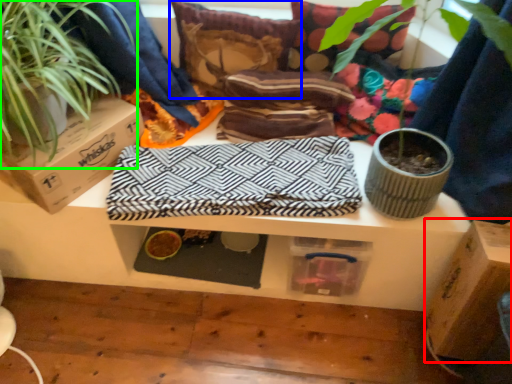
Question: Which object is positioned closest to cardboard box (highlighted by a red box)? Select from pillow (highlighted by a blue box) and houseplant (highlighted by a green box).

Choices:
 (A) pillow
 (B) houseplant

Answer: (A)